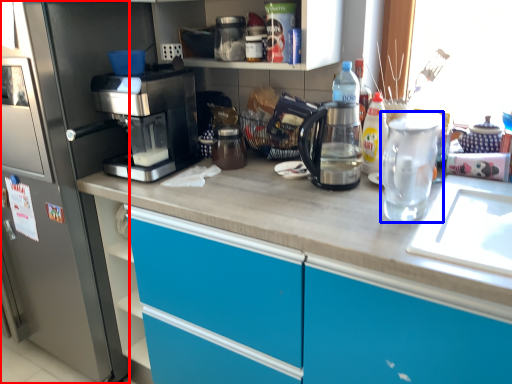
Question: Which object is further to the camera taking this photo, home appliance (highlighted by a red box) or tea pot (highlighted by a blue box)?

Choices:
 (A) home appliance
 (B) tea pot

Answer: (A)